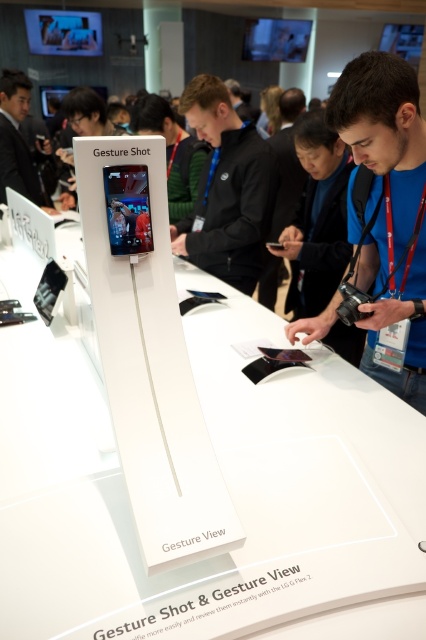
You are at a tech exhibition and see two matte black devices on a display table. The first is the matte black phone at upper left, and the second is the matte black smartphone at center. If you want to choose the taller device for a demonstration, which one should you pick?

The matte black phone at upper left is taller than the matte black smartphone at center, so you should pick the matte black phone at upper left for the demonstration.

You are at a tech event and want to take a photo of the black fabric jacket at center without including the matte black phone at upper left in the frame. Is the jacket positioned in a way that allows this?

The black fabric jacket at center is positioned under the matte black phone at upper left, so if you angle your camera downward slightly, you can capture the jacket without the phone appearing in the frame.

You are at a tech exhibition and see two smartphones displayed on a stand. The matte black smartphone at center and the black glossy smartphone at center. Which one is positioned lower on the stand?

The matte black smartphone at center is positioned lower on the stand because it is below the black glossy smartphone at center.